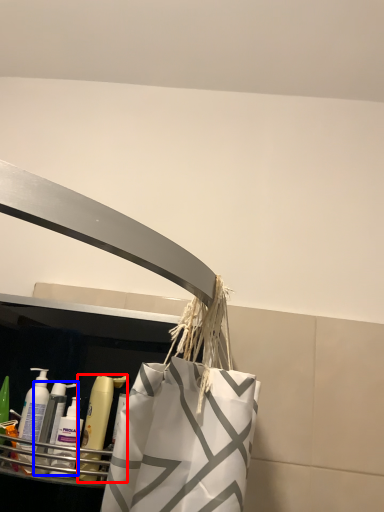
Question: Which of the following is the farthest to the observer, mouthwash (highlighted by a red box) or cleaning product (highlighted by a blue box)?

Choices:
 (A) mouthwash
 (B) cleaning product

Answer: (B)